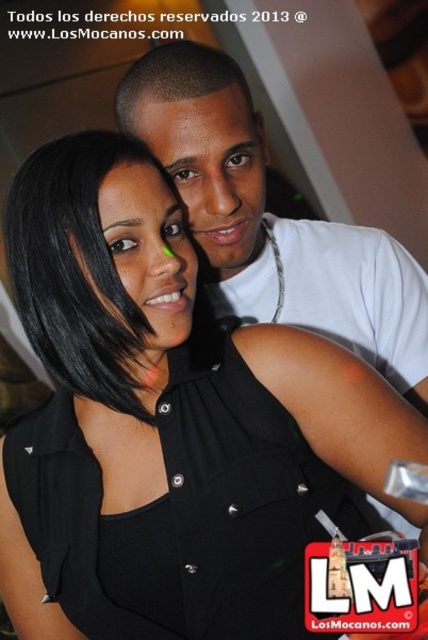
Locate an element on the screen. The width and height of the screenshot is (428, 640). black matte dress at center is located at coordinates (190, 502).

Does black matte dress at center lie behind white matte t-shirt at upper center?

No.

Based on the photo, who is more distant from viewer, (189, 620) or (258, 312)?

Positioned behind is point (258, 312).

This screenshot has height=640, width=428. I want to click on black matte dress at center, so click(x=190, y=502).